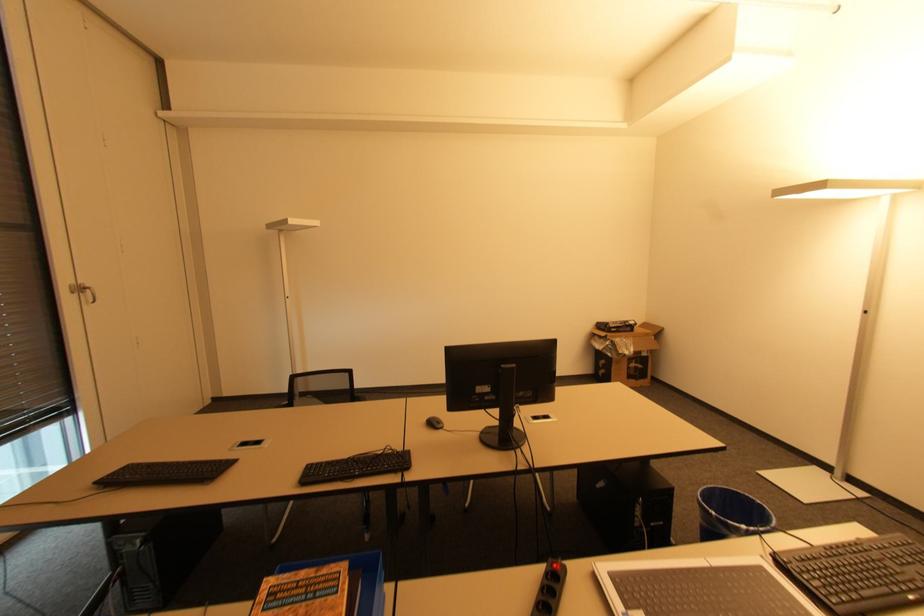
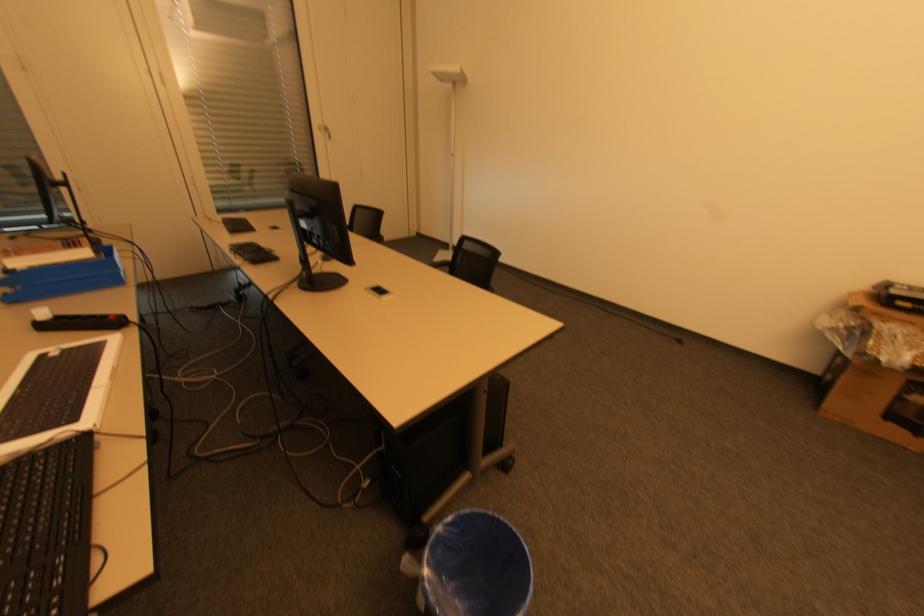
Find the pixel in the second image that matches [610,346] in the first image.

(850, 328)